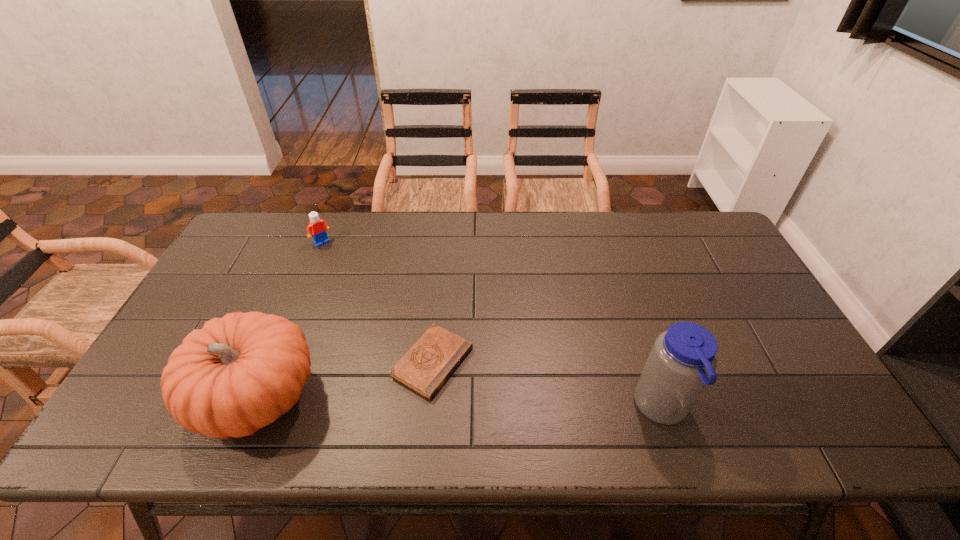
Locate an element on the screen. The width and height of the screenshot is (960, 540). free space located on the spine side of the shortest object is located at coordinates (487, 394).

This screenshot has width=960, height=540. I want to click on vacant region located on the face of the Lego, so click(381, 303).

This screenshot has width=960, height=540. I want to click on free space located on the face of the Lego, so click(x=364, y=285).

Identify the location of vacant area situated on the face of the Lego. This screenshot has height=540, width=960. (391, 313).

Find the location of a particular element. object that is at the far edge is located at coordinates (318, 228).

Locate an element on the screen. This screenshot has height=540, width=960. pumpkin that is at the near edge is located at coordinates (239, 373).

The width and height of the screenshot is (960, 540). Find the location of `water bottle situated at the near edge`. water bottle situated at the near edge is located at coordinates pyautogui.click(x=683, y=359).

Find the location of a particular element. The image size is (960, 540). diary present at the near edge is located at coordinates (429, 363).

At what (x,y) coordinates should I click in order to perform the action: click on object that is at the left edge. Please return your answer as a coordinate pair (x, y). The image size is (960, 540). Looking at the image, I should click on (239, 373).

At what (x,y) coordinates should I click in order to perform the action: click on object at the near left corner. Please return your answer as a coordinate pair (x, y). This screenshot has width=960, height=540. Looking at the image, I should click on (239, 373).